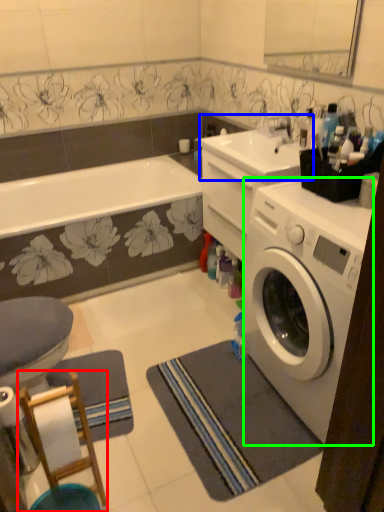
Question: Considering the real-world distances, which object is farthest from bar stool (highlighted by a red box)? sink (highlighted by a blue box) or washing machine (highlighted by a green box)?

Choices:
 (A) sink
 (B) washing machine

Answer: (A)